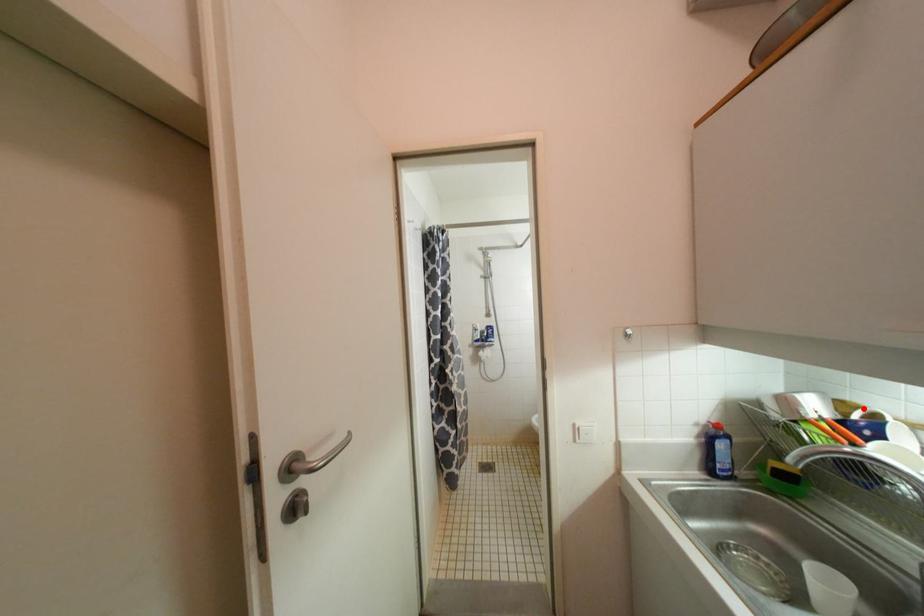
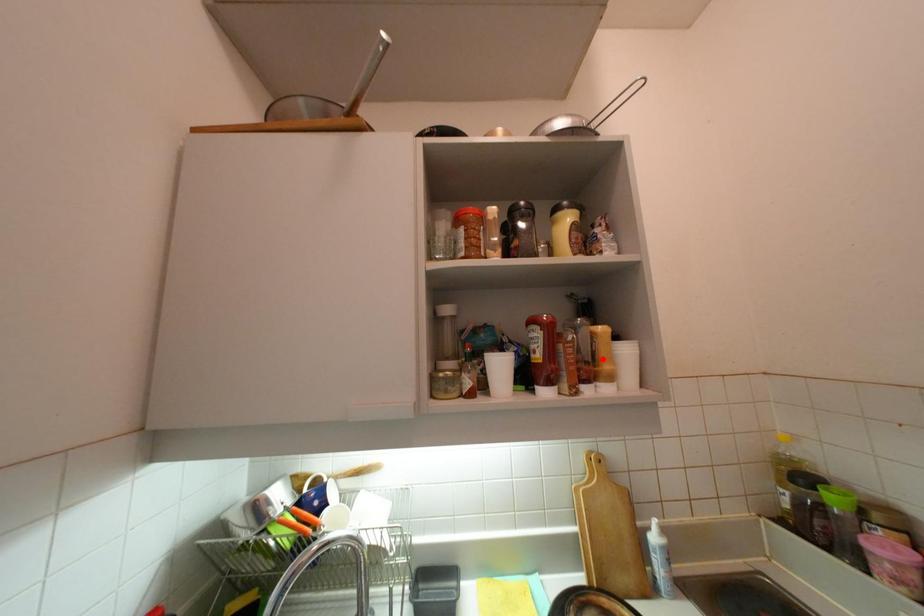
I am providing you with two images of the same scene from different viewpoints. A red point is marked on the first image and another point is marked on the second image. Are the points marked in image1 and image2 representing the same 3D position?

No